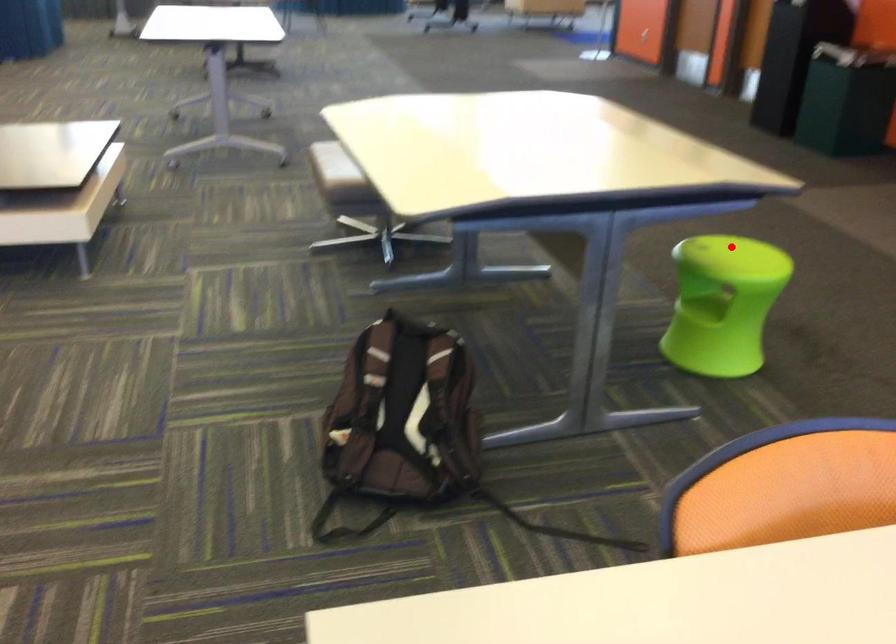
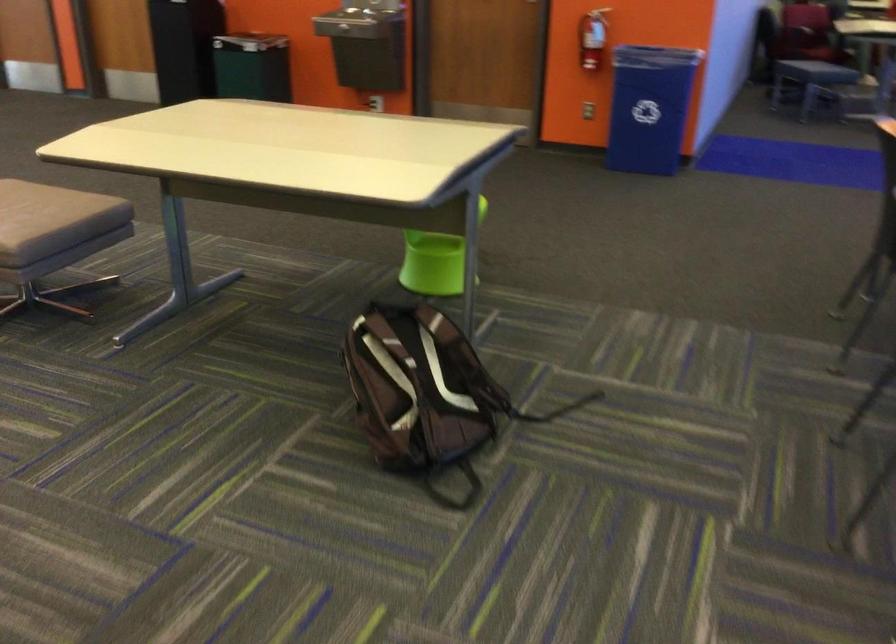
Question: I am providing you with two images of the same scene from different viewpoints. A red point is marked on the first image. Can you still see the location of the red point in image 2?

Choices:
 (A) Yes
 (B) No

Answer: (B)